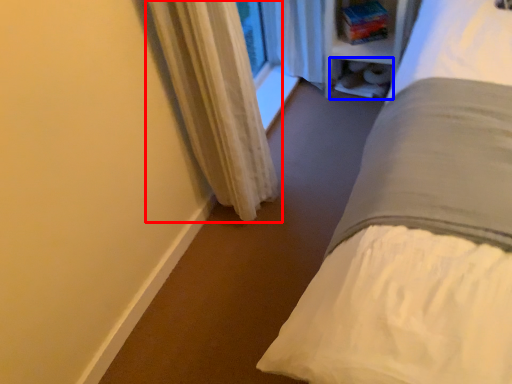
Question: Which object is further to the camera taking this photo, curtain (highlighted by a red box) or shelf (highlighted by a blue box)?

Choices:
 (A) curtain
 (B) shelf

Answer: (B)